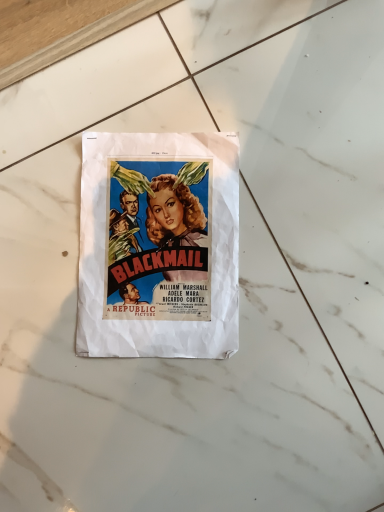
This screenshot has width=384, height=512. What do you see at coordinates (159, 246) in the screenshot?
I see `matte paper poster at center` at bounding box center [159, 246].

The height and width of the screenshot is (512, 384). I want to click on matte paper poster at center, so click(159, 246).

Where is `matte paper poster at center`? This screenshot has width=384, height=512. matte paper poster at center is located at coordinates (159, 246).